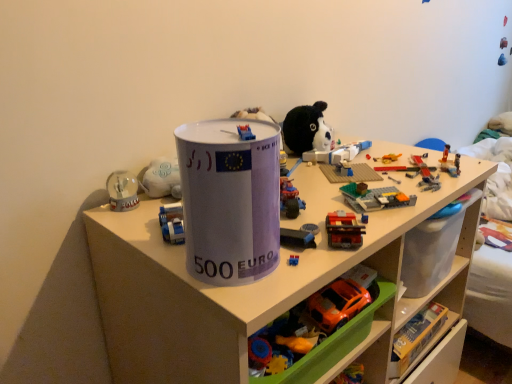
You are a GUI agent. You are given a task and a screenshot of the screen. Output one action in this format:
    pyautogui.click(x=<x>, y=<y>)
    Task: Click on the vacant space behind brick-like plastic train at center-right, the second toy positioned from the top
    Image resolution: width=512 pixels, height=384 pixels.
    Given the screenshot: What is the action you would take?
    pyautogui.click(x=337, y=196)